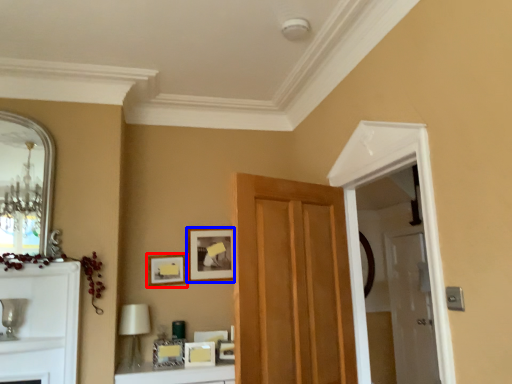
Question: Which object is further to the camera taking this photo, picture frame (highlighted by a red box) or picture frame (highlighted by a blue box)?

Choices:
 (A) picture frame
 (B) picture frame

Answer: (B)